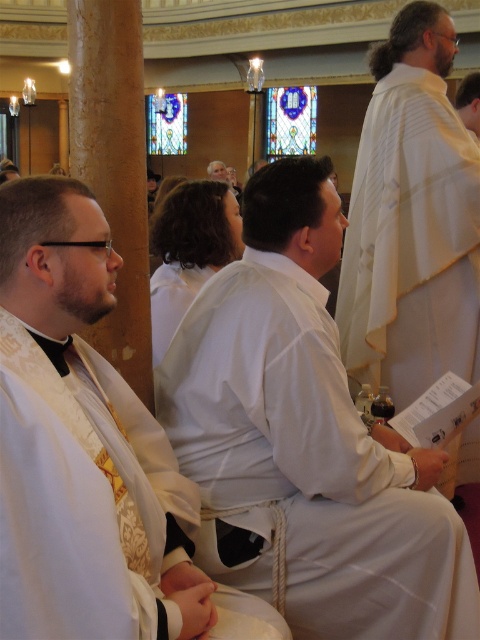
Which is more to the right, white satin robe at center or white textured robe at center?

white textured robe at center

What are the coordinates of `white satin robe at center` in the screenshot? It's located at (82, 445).

You are a GUI agent. You are given a task and a screenshot of the screen. Output one action in this format:
    pyautogui.click(x=<x>, y=<y>)
    Task: Click on the white satin robe at center
    Image resolution: width=480 pixels, height=640 pixels.
    Given the screenshot: What is the action you would take?
    pyautogui.click(x=82, y=445)

Who is shorter, white matte/soft robe at center or white satin robe at center?

white satin robe at center

Is white matte/soft robe at center wider than white satin robe at center?

Indeed, white matte/soft robe at center has a greater width compared to white satin robe at center.

The width and height of the screenshot is (480, 640). In order to click on white matte/soft robe at center in this screenshot , I will do `click(305, 442)`.

At what (x,y) coordinates should I click in order to perform the action: click on white matte/soft robe at center. Please return your answer as a coordinate pair (x, y). This screenshot has height=640, width=480. Looking at the image, I should click on (305, 442).

Is point (383, 458) less distant than point (179, 301)?

Yes, point (383, 458) is in front of point (179, 301).

Measure the distance between white matte/soft robe at center and camera.

white matte/soft robe at center and camera are 53.43 feet apart.

Find the location of a particular element. The image size is (480, 640). white matte/soft robe at center is located at coordinates (305, 442).